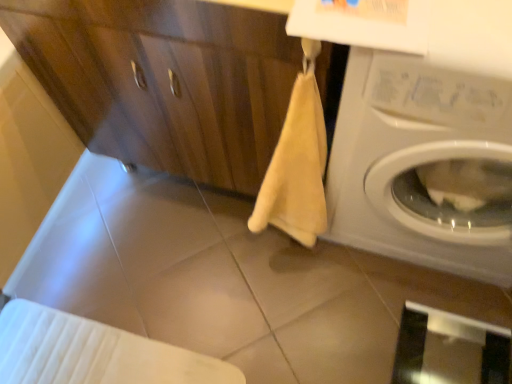
I want to click on vacant area on top of beige matte tile at center (from a real-world perspective), so click(x=204, y=297).